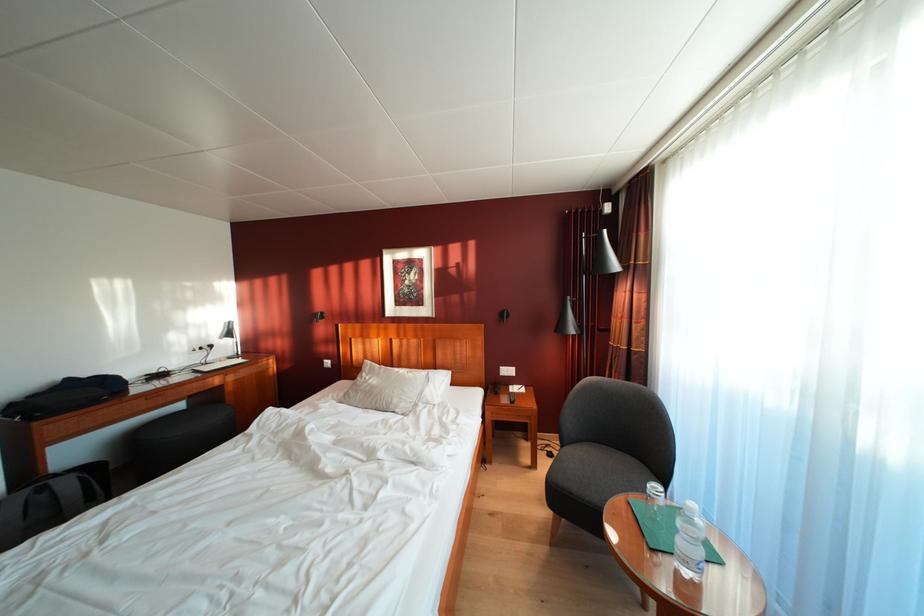
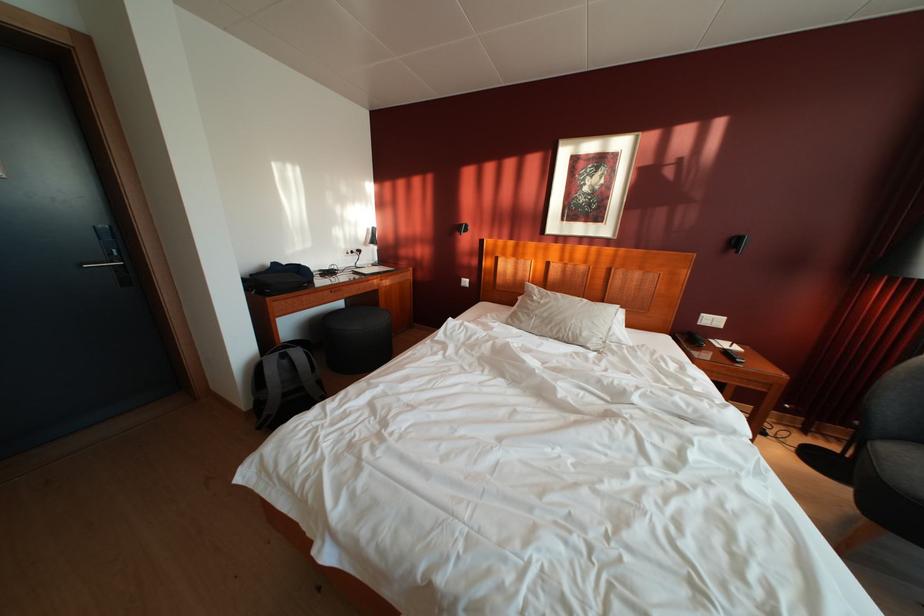
Find the pixel in the second image that matches (516,377) in the first image.

(721, 326)